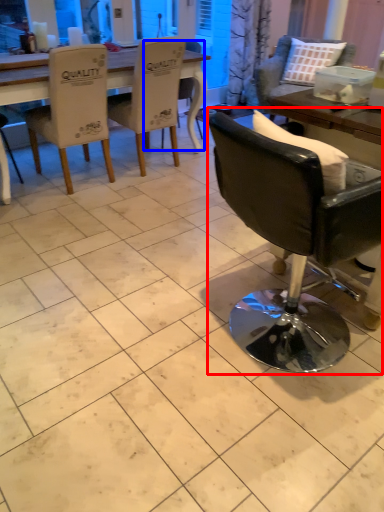
Question: Among these objects, which one is nearest to the camera, chair (highlighted by a red box) or chair (highlighted by a blue box)?

Choices:
 (A) chair
 (B) chair

Answer: (A)